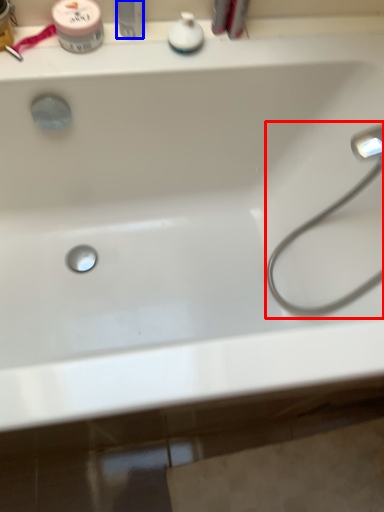
Question: Which point is further to the camera, faucet (highlighted by a red box) or toiletry (highlighted by a blue box)?

Choices:
 (A) faucet
 (B) toiletry

Answer: (B)